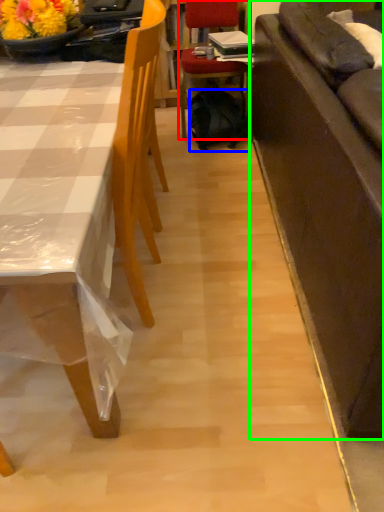
Question: Which object is the closest to the chair (highlighted by a red box)? Choose among these: backpack (highlighted by a blue box) or studio couch (highlighted by a green box).

Choices:
 (A) backpack
 (B) studio couch

Answer: (A)